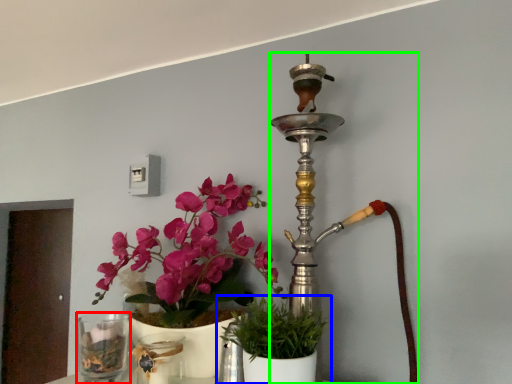
Question: Which object is the closest to the vase (highlighted by a red box)? Choose among these: houseplant (highlighted by a blue box) or candle holder (highlighted by a green box).

Choices:
 (A) houseplant
 (B) candle holder

Answer: (A)